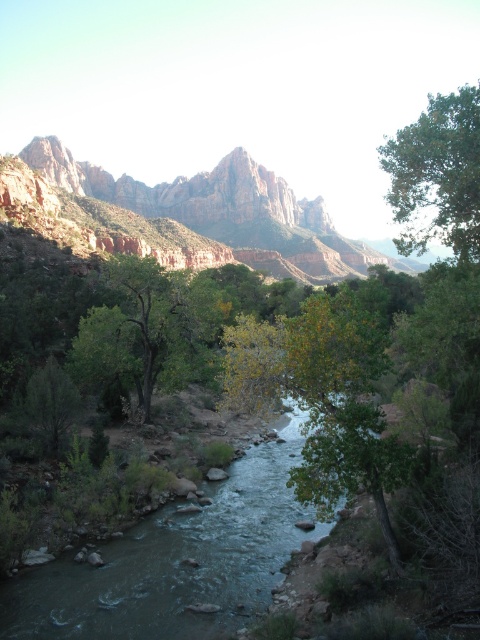
Question: Can you confirm if rustic rock formation at upper center is positioned below green leafy tree at upper right?

Choices:
 (A) no
 (B) yes

Answer: (B)

Question: Which object appears closest to the camera in this image?

Choices:
 (A) green smooth stream at center
 (B) green leafy tree at upper right

Answer: (A)

Question: Which of the following is the closest to the observer?

Choices:
 (A) (96, 168)
 (B) (200, 605)
 (C) (445, 164)

Answer: (B)

Question: From the image, what is the correct spatial relationship of green leafy tree at center in relation to green leafy tree at upper right?

Choices:
 (A) left
 (B) right

Answer: (A)

Question: Estimate the real-world distances between objects in this image. Which object is closer to the rustic rock formation at upper center?

Choices:
 (A) green smooth stream at center
 (B) green leafy tree at upper right

Answer: (B)

Question: Does rustic rock formation at upper center appear over green leafy tree at upper right?

Choices:
 (A) yes
 (B) no

Answer: (B)